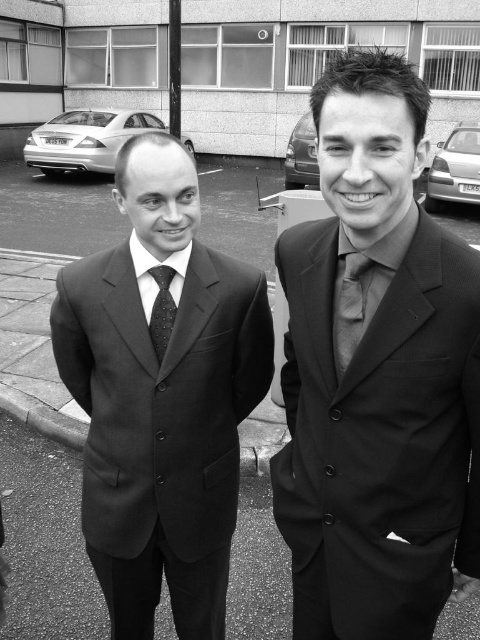
Based on the photo, you are a tailor observing two suits displayed in a store window. The black satin suit at right and the black smooth suit at center. Which one is smaller in size?

The black satin suit at right is smaller than the black smooth suit at center.

You are standing in a parking lot and want to reach a specific point marked at coordinates point [219,536]. Given that the distance from your current position to this point is 5.63 feet, how many steps would you need to take to reach it?

The distance to point [219,536] is 5.63 feet. Assuming an average step length of about 2.5 feet, you would need approximately 2 to 3 steps to reach it.